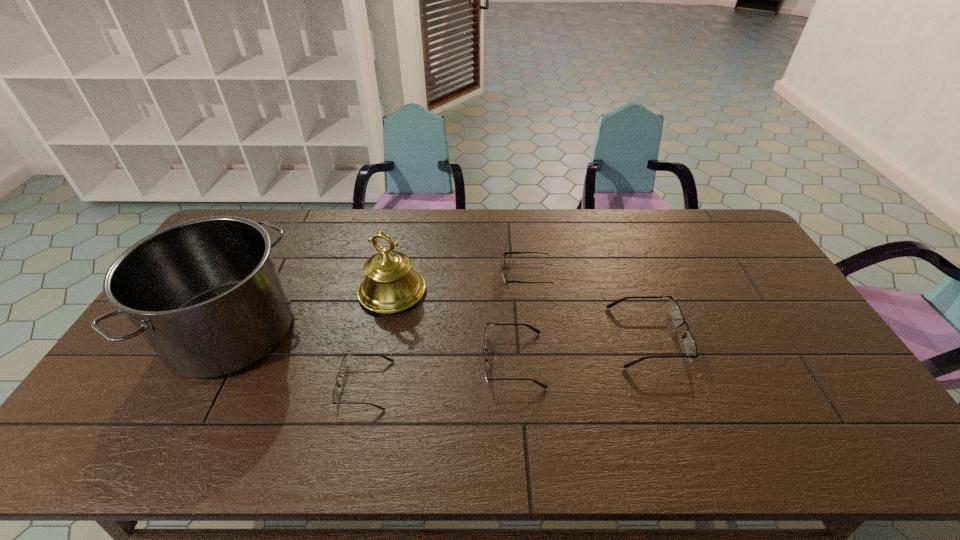
This screenshot has height=540, width=960. Identify the location of the leftmost spectacles. (344, 363).

You are a GUI agent. You are given a task and a screenshot of the screen. Output one action in this format:
    pyautogui.click(x=<x>, y=<y>)
    Task: Click on the second shortest spectacles
    The height and width of the screenshot is (540, 960).
    Given the screenshot: What is the action you would take?
    pyautogui.click(x=532, y=328)

The image size is (960, 540). Find the location of `the rightmost object`. the rightmost object is located at coordinates (674, 310).

Where is `the tallest spectacles`? The height and width of the screenshot is (540, 960). the tallest spectacles is located at coordinates [674, 310].

What are the coordinates of `the leftmost object` in the screenshot? It's located at (205, 293).

You are a GUI agent. You are given a task and a screenshot of the screen. Output one action in this format:
    pyautogui.click(x=<x>, y=<y>)
    Task: Click on the bell
    The width and height of the screenshot is (960, 540).
    Given the screenshot: What is the action you would take?
    pyautogui.click(x=390, y=285)

Find the location of a particular element. Image resolution: width=960 pixels, height=540 pixels. sunglasses is located at coordinates (502, 262).

At what (x,y) coordinates should I click in order to perform the action: click on free space located on the front-facing side of the shortest spectacles. Please return your answer as a coordinate pair (x, y). This screenshot has height=540, width=960. Looking at the image, I should click on (197, 385).

At what (x,y) coordinates should I click in order to perform the action: click on vacant space located on the front-facing side of the shortest spectacles. Please return your answer as a coordinate pair (x, y). Image resolution: width=960 pixels, height=540 pixels. Looking at the image, I should click on (204, 385).

Image resolution: width=960 pixels, height=540 pixels. Find the location of `vacant space positioned on the front-facing side of the shortest spectacles`. vacant space positioned on the front-facing side of the shortest spectacles is located at coordinates (201, 385).